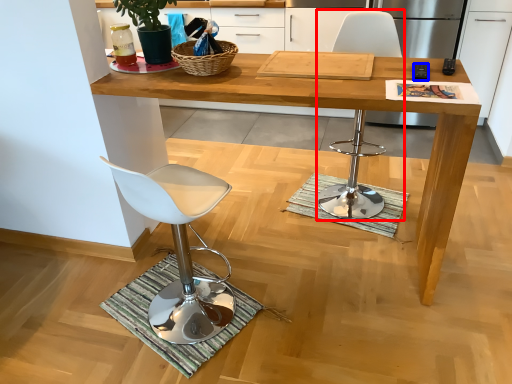
Question: Among these objects, which one is farthest to the camera, chair (highlighted by a red box) or remote control (highlighted by a blue box)?

Choices:
 (A) chair
 (B) remote control

Answer: (A)